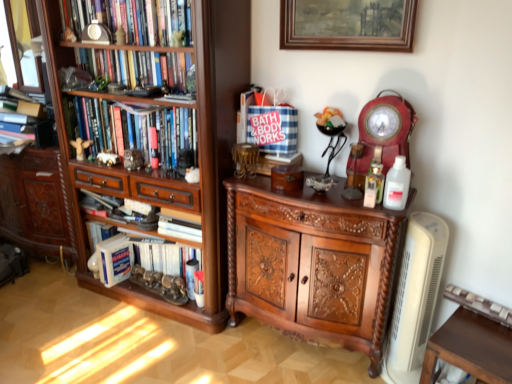
Question: Should I look upward or downward to see matte white clock at upper left, which is the 4th book in bottom-to-top order?

Choices:
 (A) down
 (B) up

Answer: (B)

Question: From a real-world perspective, is white plastic bottle at right positioned under hardcover books at left, which is counted as the second book, starting from the bottom, based on gravity?

Choices:
 (A) no
 (B) yes

Answer: (B)

Question: From the image's perspective, does white plastic bottle at right appear higher than hardcover books at left, which is counted as the second book, starting from the bottom?

Choices:
 (A) no
 (B) yes

Answer: (A)

Question: From the image's perspective, does white plastic bottle at right appear lower than hardcover books at left, which is counted as the second book, starting from the bottom?

Choices:
 (A) yes
 (B) no

Answer: (A)

Question: Is hardcover books at left, which is counted as the second book, starting from the bottom, located within white plastic bottle at right?

Choices:
 (A) no
 (B) yes

Answer: (A)

Question: Does white plastic bottle at right come in front of hardcover books at left, which ranks as the 3th book in top-to-bottom order?

Choices:
 (A) yes
 (B) no

Answer: (A)

Question: Could you tell me if white plastic bottle at right is facing hardcover books at left, which is counted as the second book, starting from the bottom?

Choices:
 (A) no
 (B) yes

Answer: (A)

Question: Can you confirm if hardcover book at lower left is wider than gold metallic toy car at left, the 1th toy when ordered from right to left?

Choices:
 (A) yes
 (B) no

Answer: (A)

Question: Are hardcover book at lower left and gold metallic toy car at left, marked as the second toy in a left-to-right arrangement, beside each other?

Choices:
 (A) no
 (B) yes

Answer: (A)

Question: From a real-world perspective, is hardcover book at lower left positioned over gold metallic toy car at left, marked as the second toy in a left-to-right arrangement, based on gravity?

Choices:
 (A) no
 (B) yes

Answer: (A)

Question: Could you tell me if hardcover book at lower left is facing gold metallic toy car at left, marked as the second toy in a left-to-right arrangement?

Choices:
 (A) yes
 (B) no

Answer: (B)

Question: From the image's perspective, does hardcover book at lower left appear lower than gold metallic toy car at left, the 1th toy when ordered from right to left?

Choices:
 (A) no
 (B) yes

Answer: (B)

Question: Is hardcover book at lower left closer to camera compared to gold metallic toy car at left, marked as the second toy in a left-to-right arrangement?

Choices:
 (A) no
 (B) yes

Answer: (A)

Question: Is matte white clock at upper left, marked as the 1th book in a top-to-bottom arrangement, outside polished wood cabinet at center?

Choices:
 (A) yes
 (B) no

Answer: (A)